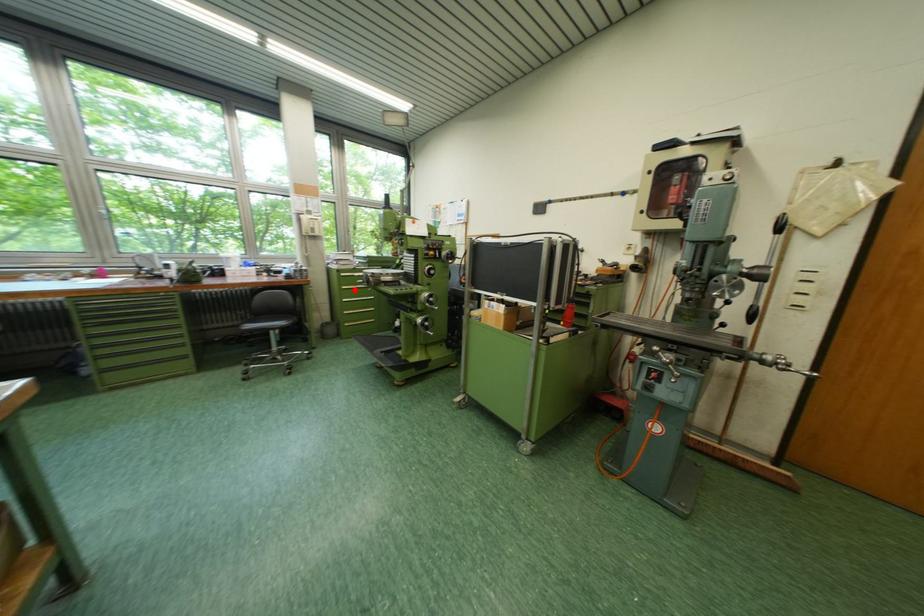
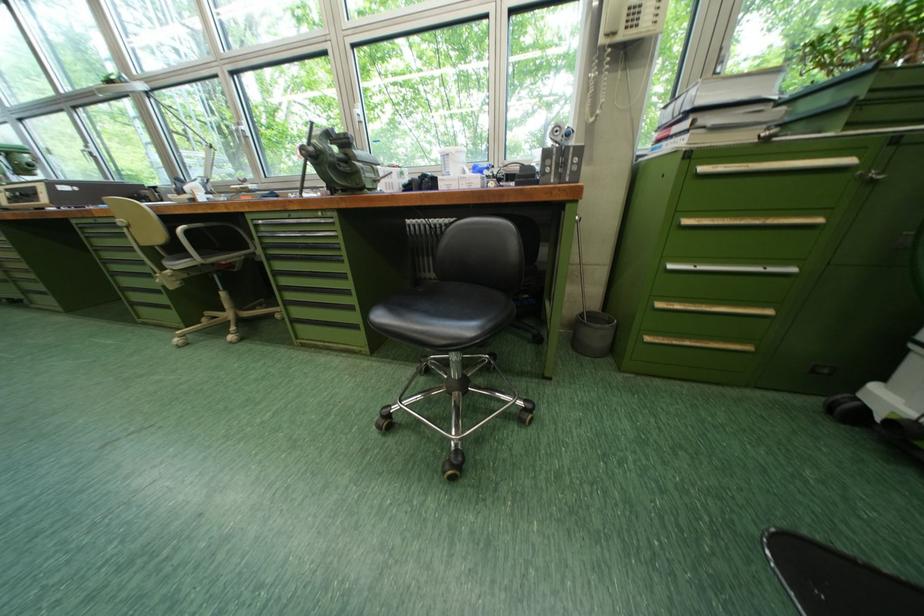
In the second image, find the point that corresponds to the highlighted location in the first image.

(698, 224)